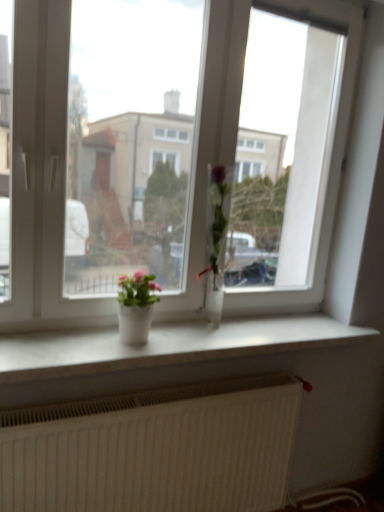
You are a GUI agent. You are given a task and a screenshot of the screen. Output one action in this format:
    pyautogui.click(x=<x>, y=<y>)
    Task: Click on the vacant space underneath matte white pot at center, which is the second houseplant in right-to-left order (from a real-world perspective)
    
    Given the screenshot: What is the action you would take?
    tap(138, 339)